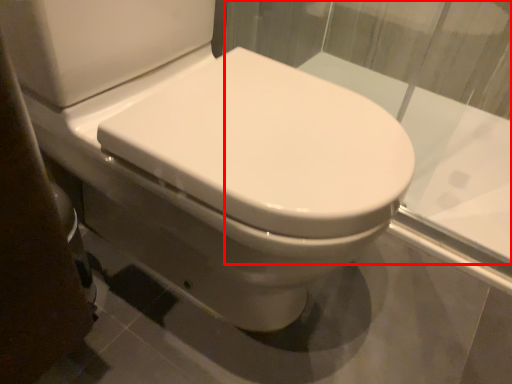
Question: From the image's perspective, considering the relative positions of glass window (annotated by the red box) and bidet in the image provided, where is glass window (annotated by the red box) located with respect to the staircase?

Choices:
 (A) below
 (B) above

Answer: (B)